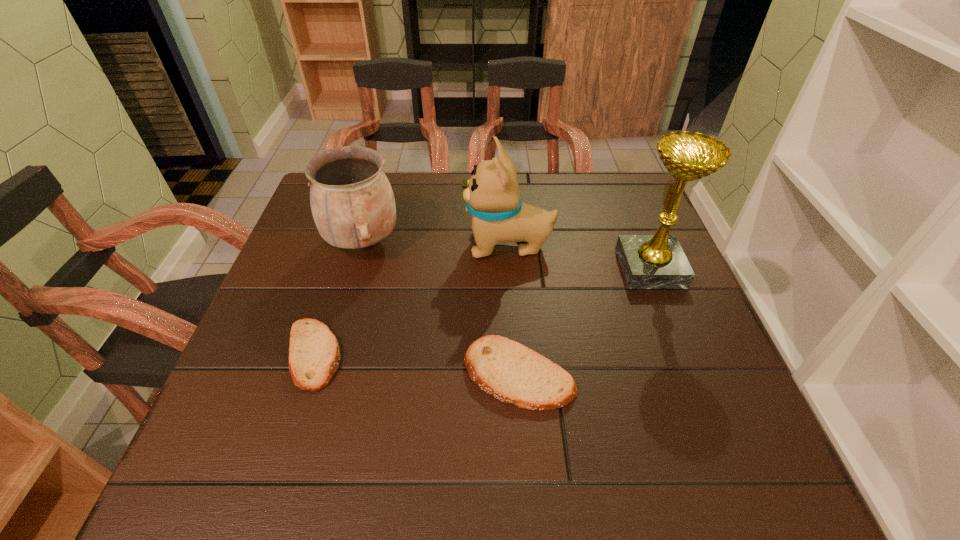
The height and width of the screenshot is (540, 960). I want to click on vacant space that satisfies the following two spatial constraints: 1. on the face of the puppy; 2. on the left side of the taller pita bread, so click(x=517, y=374).

Identify the location of free location that satisfies the following two spatial constraints: 1. on the face of the second tallest object; 2. on the back side of the second shortest object. The width and height of the screenshot is (960, 540). (517, 374).

The image size is (960, 540). I want to click on vacant space that satisfies the following two spatial constraints: 1. on the front side of the taller pita bread; 2. on the left side of the urn, so click(325, 374).

You are a GUI agent. You are given a task and a screenshot of the screen. Output one action in this format:
    pyautogui.click(x=<x>, y=<y>)
    Task: Click on the free spot that satisfies the following two spatial constraints: 1. on the face of the fourth shortest object; 2. on the back side of the taller pita bread
    Image resolution: width=960 pixels, height=540 pixels.
    Given the screenshot: What is the action you would take?
    pyautogui.click(x=517, y=374)